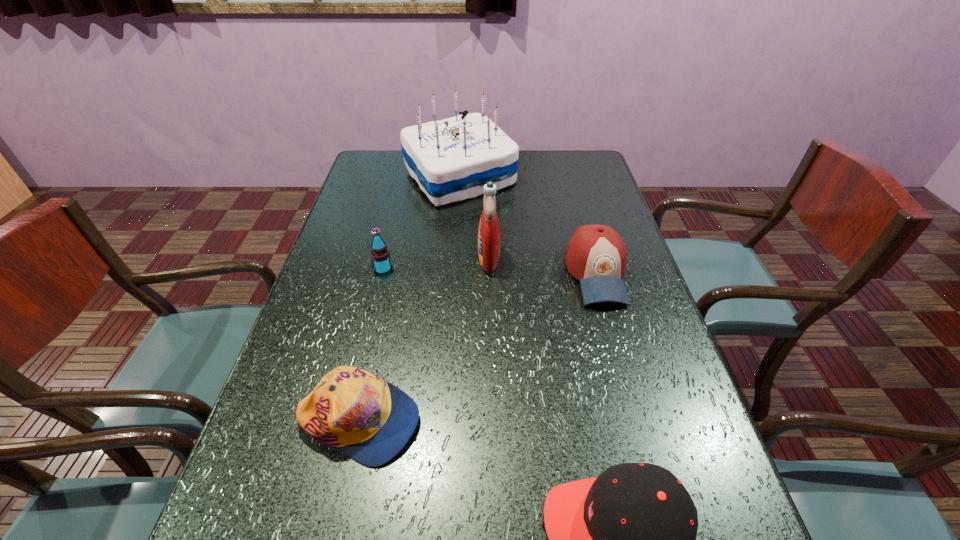
Where is `vacant space at the left edge of the desktop`? The image size is (960, 540). vacant space at the left edge of the desktop is located at coordinates (348, 252).

Where is `vacant space at the right edge of the desktop`? vacant space at the right edge of the desktop is located at coordinates (610, 327).

Where is `free space at the far left corner of the desktop`? free space at the far left corner of the desktop is located at coordinates (371, 157).

This screenshot has height=540, width=960. I want to click on vacant space at the far right corner of the desktop, so click(559, 156).

The image size is (960, 540). What are the coordinates of `vacant space that is in between the detergent and the baseball cap` in the screenshot? It's located at (542, 266).

The image size is (960, 540). Identify the location of unoccupied area between the tallest object and the detergent. (474, 217).

What are the coordinates of `blank region between the baseball cap and the second nearest object` in the screenshot? It's located at (478, 347).

Locate an element on the screen. This screenshot has height=540, width=960. free space that is in between the soda and the birthday cake is located at coordinates (421, 222).

Where is `free space that is in between the tallest object and the soda`? This screenshot has width=960, height=540. free space that is in between the tallest object and the soda is located at coordinates (421, 222).

The image size is (960, 540). In order to click on free point between the birthday cake and the farther cap in this screenshot , I will do `click(409, 299)`.